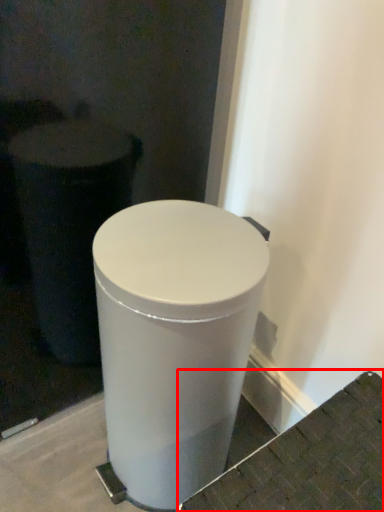
Question: Observing the image, what is the correct spatial positioning of concrete (annotated by the red box) in reference to waste container?

Choices:
 (A) right
 (B) left

Answer: (A)